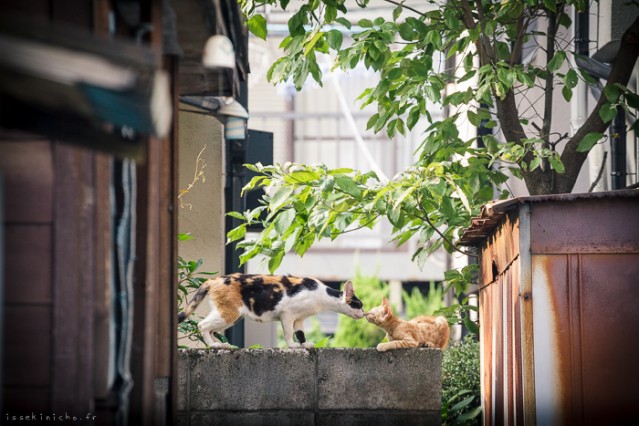
The image size is (639, 426). In order to click on wall in this screenshot , I will do `click(330, 389)`.